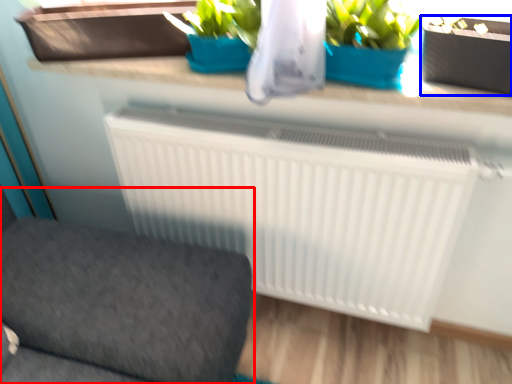
Question: Which object appears farthest to the camera in this image, furniture (highlighted by a red box) or flowerpot (highlighted by a blue box)?

Choices:
 (A) furniture
 (B) flowerpot

Answer: (B)